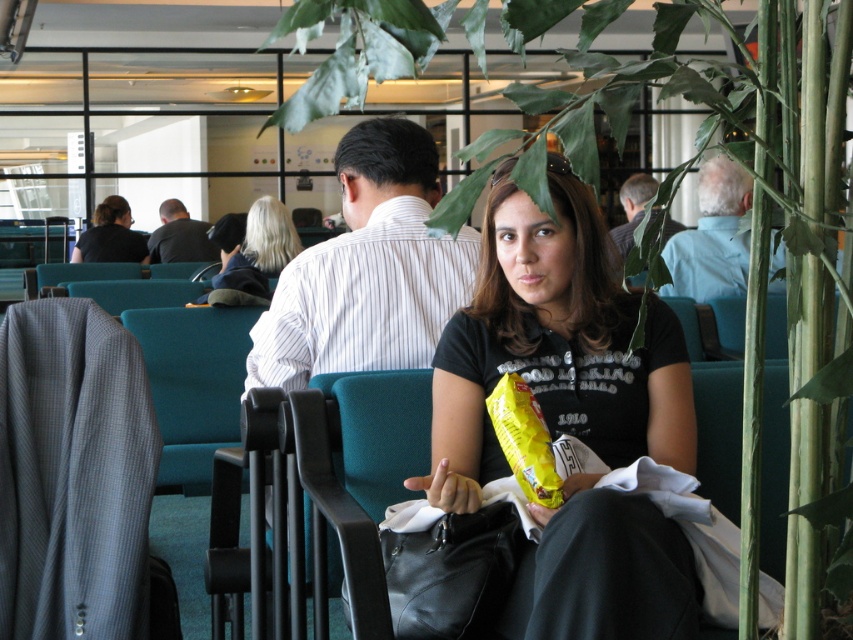
Does green fabric chair at center have a lesser height compared to dark gray shirt at center?

Correct, green fabric chair at center is not as tall as dark gray shirt at center.

Does green fabric chair at center have a lesser width compared to dark gray shirt at center?

Yes, green fabric chair at center is thinner than dark gray shirt at center.

Locate an element on the screen. This screenshot has height=640, width=853. green fabric chair at center is located at coordinates [729, 323].

The width and height of the screenshot is (853, 640). Find the location of `green fabric chair at center`. green fabric chair at center is located at coordinates (729, 323).

Is point (726, 189) farther from viewer compared to point (86, 257)?

No, it is not.

Is blue cotton shirt at upper right closer to the viewer compared to matte black shirt at center?

Yes, it is in front of matte black shirt at center.

Identify the location of blue cotton shirt at upper right. (712, 236).

Does white striped shirt at center have a larger size compared to black leather bag at center?

Yes, white striped shirt at center is bigger than black leather bag at center.

Which is more to the left, white striped shirt at center or black leather bag at center?

Positioned to the left is white striped shirt at center.

Where is `white striped shirt at center`? white striped shirt at center is located at coordinates (368, 269).

The image size is (853, 640). Identify the location of white striped shirt at center. (368, 269).